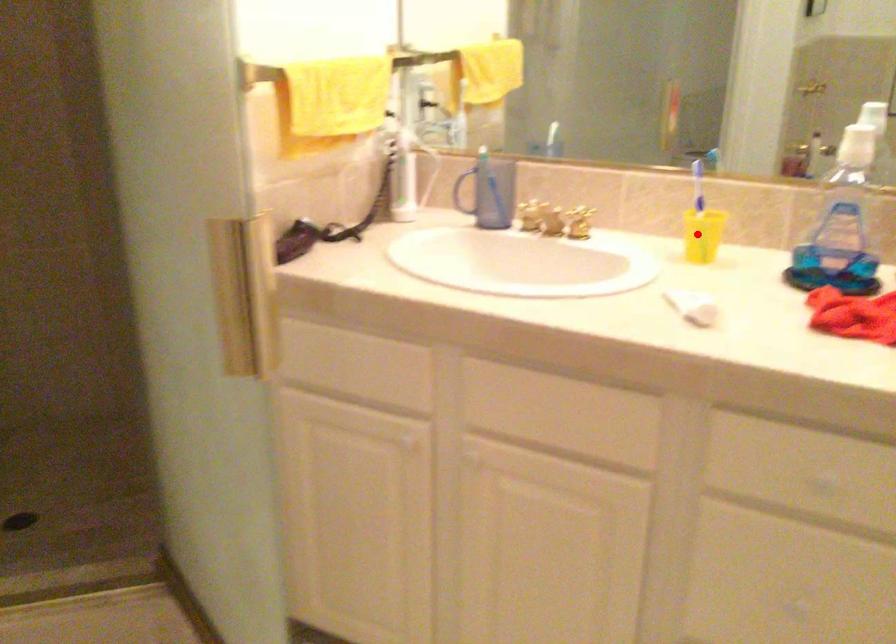
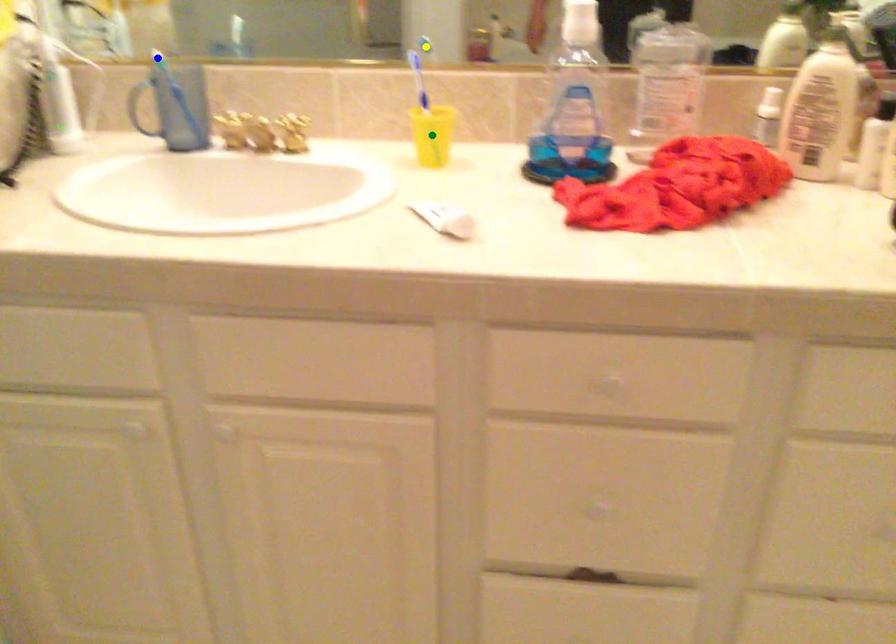
Question: I am providing you with two images of the same scene from different viewpoints. A red point is marked on the first image. You are given multiple points on the second image. Can you choose the point in image 2 that corresponds to the point in image 1?

Choices:
 (A) blue point
 (B) yellow point
 (C) green point

Answer: (C)